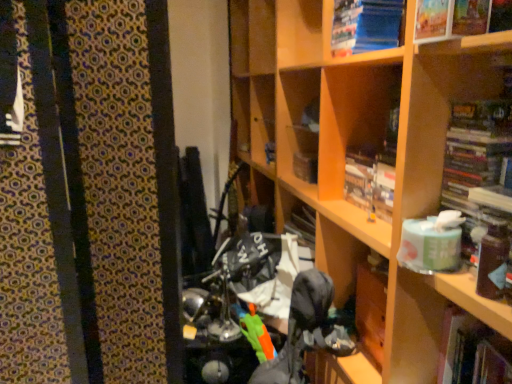
Question: Does hardcover book at lower right, acting as the first book starting from the bottom, have a greater width compared to blue paper at upper right, arranged as the 5th book when ordered from the bottom?

Choices:
 (A) yes
 (B) no

Answer: (A)

Question: From a real-world perspective, does hardcover book at lower right, marked as the fifth book in a top-to-bottom arrangement, sit lower than blue paper at upper right, which appears as the 1th book when viewed from the top?

Choices:
 (A) yes
 (B) no

Answer: (A)

Question: Considering the relative sizes of hardcover book at lower right, acting as the first book starting from the bottom, and blue paper at upper right, which appears as the 1th book when viewed from the top, in the image provided, is hardcover book at lower right, acting as the first book starting from the bottom, thinner than blue paper at upper right, which appears as the 1th book when viewed from the top,?

Choices:
 (A) no
 (B) yes

Answer: (A)

Question: Does hardcover book at lower right, marked as the fifth book in a top-to-bottom arrangement, lie in front of blue paper at upper right, which appears as the 1th book when viewed from the top?

Choices:
 (A) no
 (B) yes

Answer: (B)

Question: Is hardcover book at lower right, acting as the first book starting from the bottom, facing towards blue paper at upper right, arranged as the 5th book when ordered from the bottom?

Choices:
 (A) no
 (B) yes

Answer: (A)

Question: Is hardcover book at lower right, marked as the fifth book in a top-to-bottom arrangement, surrounding blue paper at upper right, arranged as the 5th book when ordered from the bottom?

Choices:
 (A) yes
 (B) no

Answer: (B)

Question: Is hardcover book at right, which appears as the second book when ordered from the bottom, at the left side of hardcover book at lower right, marked as the fifth book in a top-to-bottom arrangement?

Choices:
 (A) no
 (B) yes

Answer: (B)

Question: Can you confirm if hardcover book at right, which appears as the second book when ordered from the bottom, is thinner than hardcover book at lower right, acting as the first book starting from the bottom?

Choices:
 (A) no
 (B) yes

Answer: (B)

Question: From a real-world perspective, is hardcover book at right, which is counted as the fourth book, starting from the top, located beneath hardcover book at lower right, acting as the first book starting from the bottom?

Choices:
 (A) yes
 (B) no

Answer: (B)

Question: Is hardcover book at right, which is counted as the fourth book, starting from the top, positioned in front of hardcover book at lower right, acting as the first book starting from the bottom?

Choices:
 (A) no
 (B) yes

Answer: (B)

Question: Considering the relative positions of hardcover book at right, which is counted as the fourth book, starting from the top, and hardcover book at lower right, marked as the fifth book in a top-to-bottom arrangement, in the image provided, is hardcover book at right, which is counted as the fourth book, starting from the top, to the right of hardcover book at lower right, marked as the fifth book in a top-to-bottom arrangement, from the viewer's perspective?

Choices:
 (A) no
 (B) yes

Answer: (A)

Question: Is the depth of hardcover book at right, which appears as the second book when ordered from the bottom, greater than that of hardcover book at lower right, acting as the first book starting from the bottom?

Choices:
 (A) yes
 (B) no

Answer: (B)

Question: From a real-world perspective, does hardcover book at lower right, acting as the first book starting from the bottom, sit lower than hardcover book at right, which is counted as the fourth book, starting from the top?

Choices:
 (A) yes
 (B) no

Answer: (A)